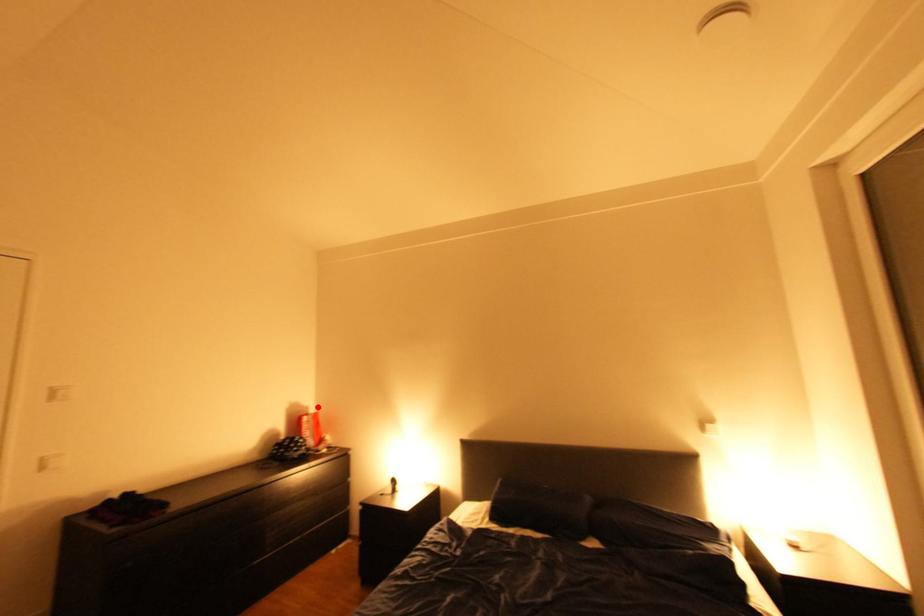
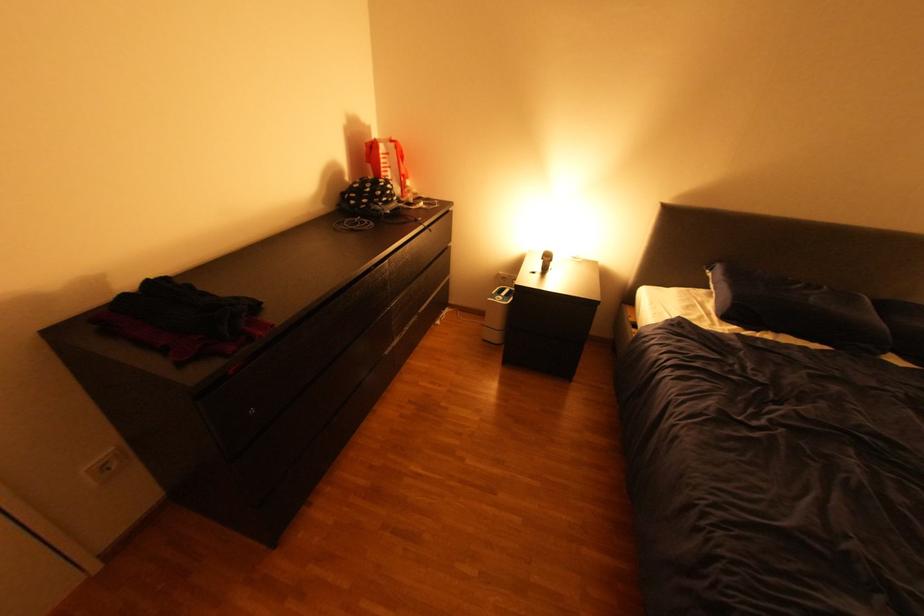
Locate, in the second image, the point that corresponds to the highlighted location in the first image.

(379, 129)